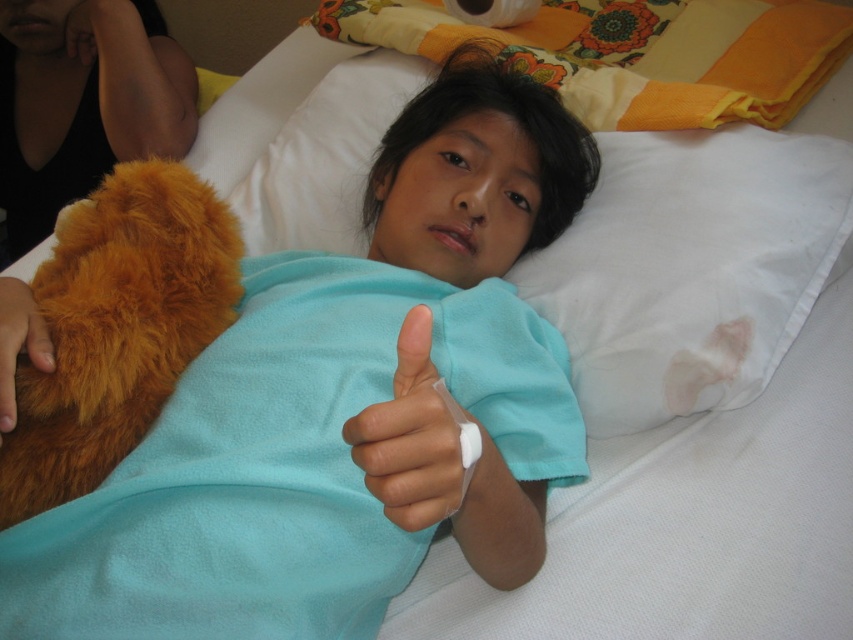
Does point (791, 140) come behind point (387, 496)?

Yes, it is.

Looking at this image, is white soft pillow at upper center shorter than white plastic bandage at center?

No, white soft pillow at upper center is not shorter than white plastic bandage at center.

Does point (730, 364) come closer to viewer compared to point (432, 474)?

No, (730, 364) is further to viewer.

Find the location of a particular element. white soft pillow at upper center is located at coordinates (689, 268).

Is fuzzy orange teddy bear at left bigger than white plastic bandage at center?

Correct, fuzzy orange teddy bear at left is larger in size than white plastic bandage at center.

Locate an element on the screen. fuzzy orange teddy bear at left is located at coordinates (117, 326).

Where is `fuzzy orange teddy bear at left`? The width and height of the screenshot is (853, 640). fuzzy orange teddy bear at left is located at coordinates (117, 326).

Is brown fuzzy stuffed animal at left thinner than brown furry hand at lower left?

No.

Based on the photo, is brown fuzzy stuffed animal at left shorter than brown furry hand at lower left?

No, brown fuzzy stuffed animal at left is not shorter than brown furry hand at lower left.

Locate an element on the screen. This screenshot has height=640, width=853. brown fuzzy stuffed animal at left is located at coordinates (83, 100).